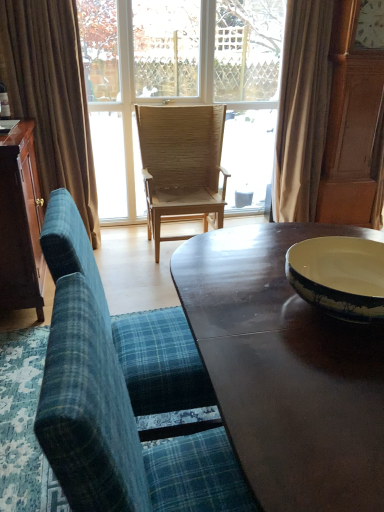
Question: Is beige fabric curtain at upper right, which is the 1th curtain in right-to-left order, taller than blue plaid fabric chair at lower left, which is the 3th chair in back-to-front order?

Choices:
 (A) yes
 (B) no

Answer: (A)

Question: Does beige fabric curtain at upper right, which is the 1th curtain in right-to-left order, have a smaller size compared to blue plaid fabric chair at lower left, the 1th chair positioned from the front?

Choices:
 (A) no
 (B) yes

Answer: (A)

Question: Can you confirm if beige fabric curtain at upper right, the second curtain viewed from the left, is positioned to the left of blue plaid fabric chair at lower left, the 1th chair positioned from the front?

Choices:
 (A) no
 (B) yes

Answer: (A)

Question: Is beige fabric curtain at upper right, the second curtain viewed from the left, facing away from blue plaid fabric chair at lower left, the 1th chair positioned from the front?

Choices:
 (A) no
 (B) yes

Answer: (A)

Question: Is blue plaid fabric chair at lower left, which is the 3th chair in back-to-front order, surrounded by beige fabric curtain at upper right, the second curtain viewed from the left?

Choices:
 (A) yes
 (B) no

Answer: (B)

Question: From a real-world perspective, is shiny dark wood coffee table at center above or below brown fabric curtain at left, marked as the first curtain in a left-to-right arrangement?

Choices:
 (A) below
 (B) above

Answer: (A)

Question: Is point (264, 481) closer or farther from the camera than point (57, 159)?

Choices:
 (A) closer
 (B) farther

Answer: (A)

Question: From the image's perspective, is shiny dark wood coffee table at center above or below brown fabric curtain at left, marked as the first curtain in a left-to-right arrangement?

Choices:
 (A) above
 (B) below

Answer: (B)

Question: Looking at their shapes, would you say shiny dark wood coffee table at center is wider or thinner than brown fabric curtain at left, marked as the first curtain in a left-to-right arrangement?

Choices:
 (A) thin
 (B) wide

Answer: (B)

Question: From a real-world perspective, is yellow ceramic bowl at right positioned above or below shiny dark wood coffee table at center?

Choices:
 (A) above
 (B) below

Answer: (A)

Question: Is yellow ceramic bowl at right spatially inside shiny dark wood coffee table at center, or outside of it?

Choices:
 (A) outside
 (B) inside

Answer: (A)

Question: In the image, is yellow ceramic bowl at right positioned in front of or behind shiny dark wood coffee table at center?

Choices:
 (A) behind
 (B) front

Answer: (A)

Question: Is yellow ceramic bowl at right to the left or to the right of shiny dark wood coffee table at center in the image?

Choices:
 (A) left
 (B) right

Answer: (B)

Question: From the image's perspective, is dark brown wood cabinet at left above or below clear glass window at center?

Choices:
 (A) above
 (B) below

Answer: (B)

Question: Is point (26, 180) positioned closer to the camera than point (249, 152)?

Choices:
 (A) closer
 (B) farther

Answer: (A)